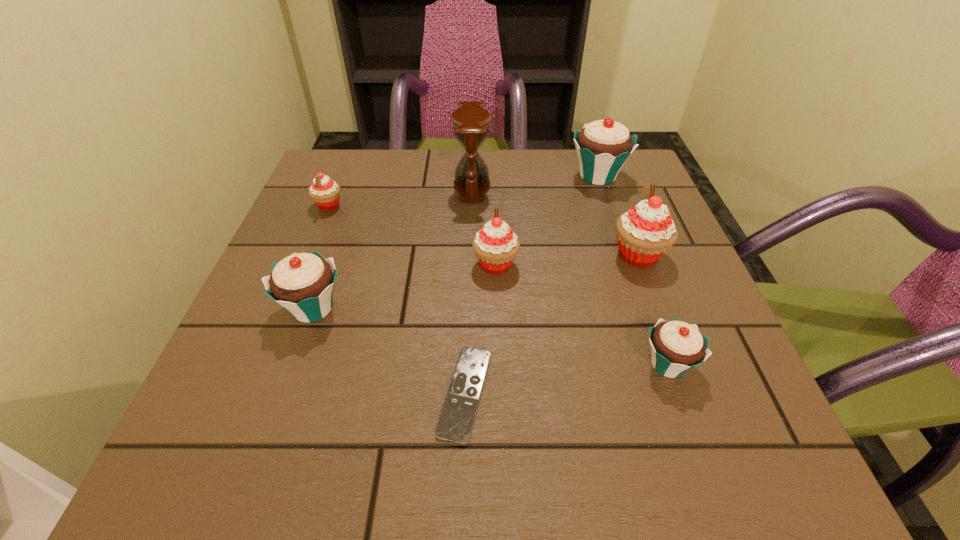
The height and width of the screenshot is (540, 960). Identify the location of the nearest teal cupcake. (676, 346).

Identify the location of the nearest cupcake. This screenshot has width=960, height=540. (676, 346).

Locate an element on the screen. the shortest object is located at coordinates pos(455,424).

Find the location of a particular element. Image resolution: width=960 pixels, height=540 pixels. blank space located on the right of the brown hourglass is located at coordinates (529, 185).

Where is `free space located on the front of the farthest teal cupcake`? free space located on the front of the farthest teal cupcake is located at coordinates (612, 217).

Where is `blank area located 0.290m on the front of the rightmost pink cupcake`? blank area located 0.290m on the front of the rightmost pink cupcake is located at coordinates (700, 420).

This screenshot has height=540, width=960. I want to click on free space located on the front of the second pink cupcake from left to right, so click(497, 309).

This screenshot has height=540, width=960. What are the coordinates of `free space located 0.050m on the right of the second farthest teal cupcake` in the screenshot? It's located at (375, 308).

Where is `vacant point located on the right of the leftmost pink cupcake`? vacant point located on the right of the leftmost pink cupcake is located at coordinates (497, 205).

Image resolution: width=960 pixels, height=540 pixels. What are the coordinates of `vacant area situated 0.340m on the back of the nearest cupcake` in the screenshot? It's located at (614, 214).